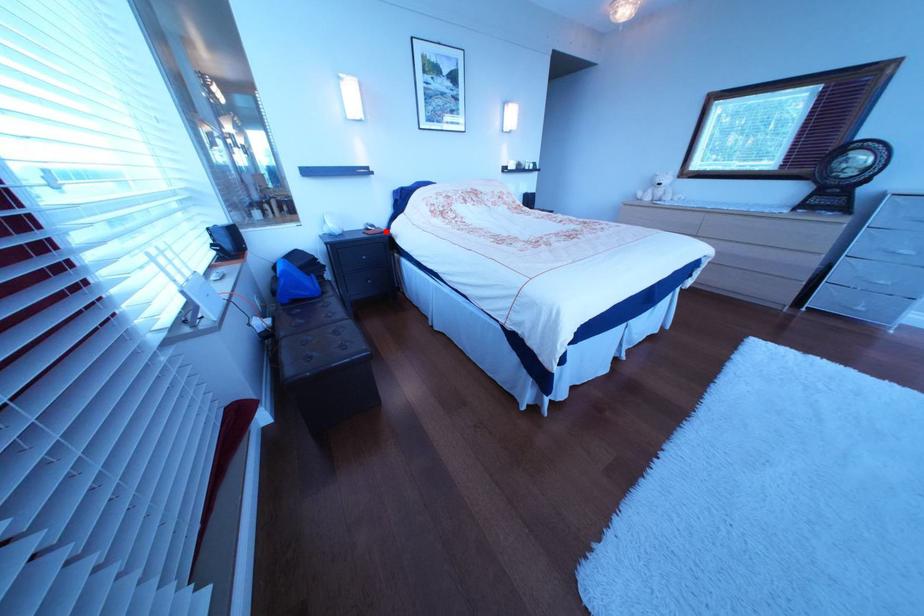
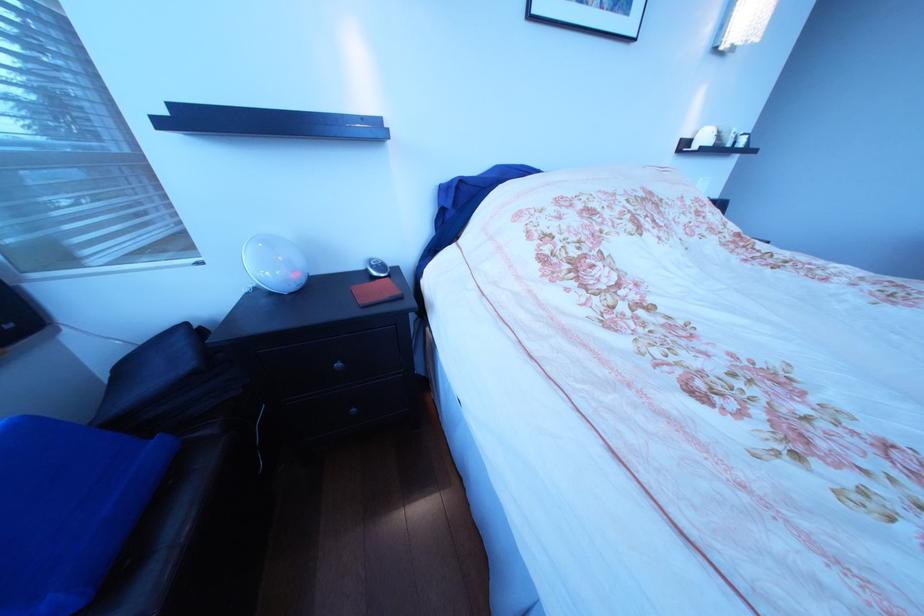
Locate, in the second image, the point that corresponds to the highlighted location in the first image.

(388, 281)